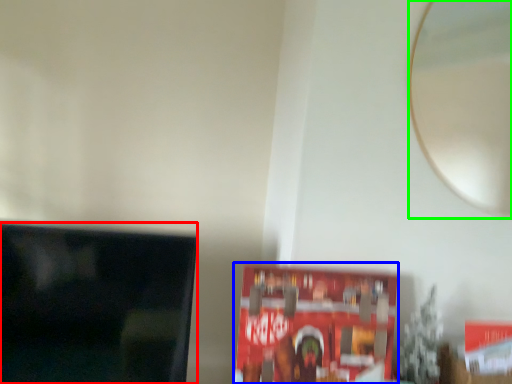
Question: Which is nearer to the television (highlighted by a red box)? paperback book (highlighted by a blue box) or mirror (highlighted by a green box).

Choices:
 (A) paperback book
 (B) mirror

Answer: (A)